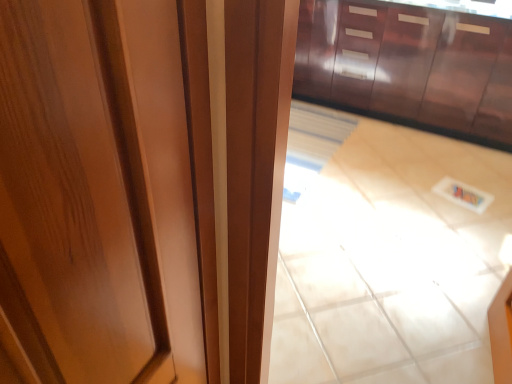
Question: Can you confirm if glossy wood cabinetry at upper center is shorter than glossy wood door at center?

Choices:
 (A) yes
 (B) no

Answer: (A)

Question: Can you confirm if glossy wood cabinetry at upper center is taller than glossy wood door at center?

Choices:
 (A) no
 (B) yes

Answer: (A)

Question: Is glossy wood cabinetry at upper center far from glossy wood door at center?

Choices:
 (A) yes
 (B) no

Answer: (A)

Question: Is glossy wood cabinetry at upper center further to the viewer compared to glossy wood door at center?

Choices:
 (A) yes
 (B) no

Answer: (A)

Question: Is glossy wood cabinetry at upper center at the right side of glossy wood door at center?

Choices:
 (A) no
 (B) yes

Answer: (B)

Question: Does glossy wood cabinetry at upper center appear on the left side of glossy wood door at center?

Choices:
 (A) yes
 (B) no

Answer: (B)

Question: Considering the relative sizes of beige glossy tile at center and glossy wood door at center in the image provided, is beige glossy tile at center shorter than glossy wood door at center?

Choices:
 (A) no
 (B) yes

Answer: (B)

Question: Does beige glossy tile at center lie behind glossy wood door at center?

Choices:
 (A) no
 (B) yes

Answer: (B)

Question: Is glossy wood door at center a part of beige glossy tile at center?

Choices:
 (A) yes
 (B) no

Answer: (B)

Question: From a real-world perspective, is beige glossy tile at center located higher than glossy wood door at center?

Choices:
 (A) yes
 (B) no

Answer: (A)

Question: Does beige glossy tile at center have a greater width compared to glossy wood door at center?

Choices:
 (A) yes
 (B) no

Answer: (A)

Question: Is beige glossy tile at center thinner than glossy wood door at center?

Choices:
 (A) yes
 (B) no

Answer: (B)

Question: Is glossy wood door at center facing away from glossy wood cabinetry at upper center?

Choices:
 (A) no
 (B) yes

Answer: (A)